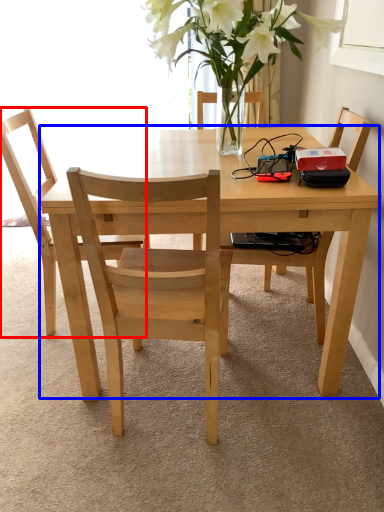
Question: Which object is further to the camera taking this photo, chair (highlighted by a red box) or kitchen & dining room table (highlighted by a blue box)?

Choices:
 (A) chair
 (B) kitchen & dining room table

Answer: (A)